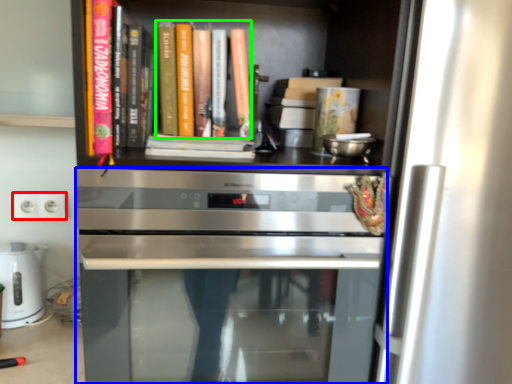
Question: Based on their relative distances, which object is nearer to electric outlet (highlighted by a red box)? Choose from oven (highlighted by a blue box) and book (highlighted by a green box).

Choices:
 (A) oven
 (B) book

Answer: (A)